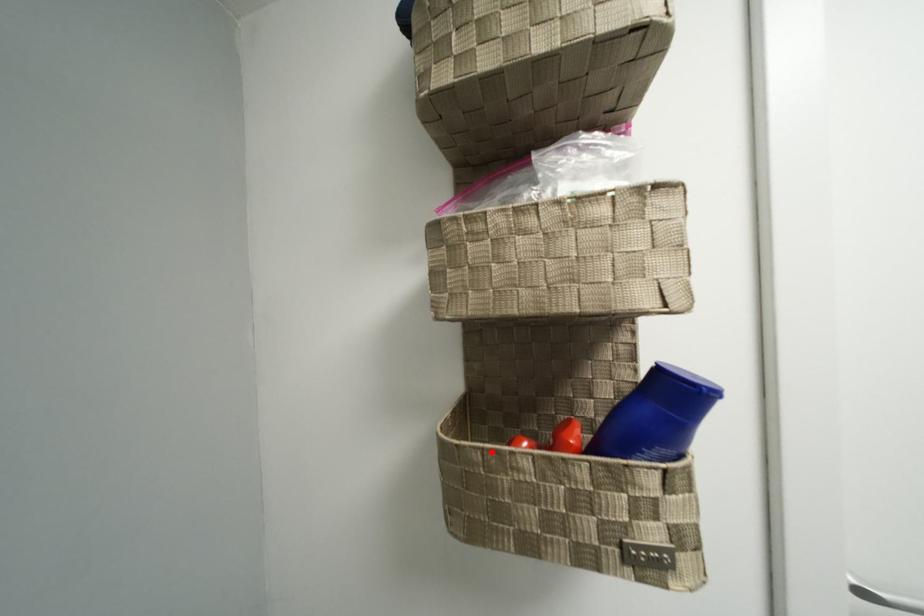
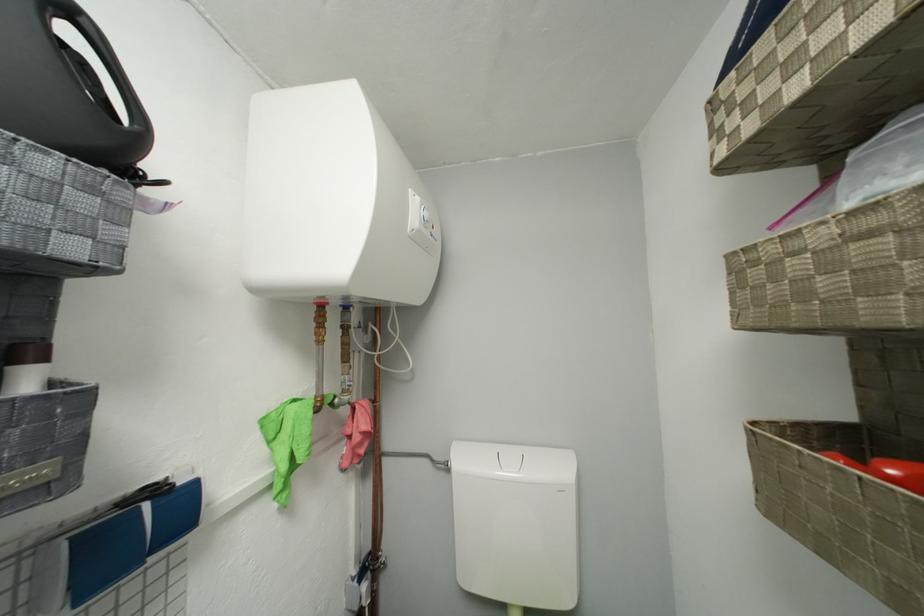
The point at the highlighted location is marked in the first image. Where is the corresponding point in the second image?

(781, 442)